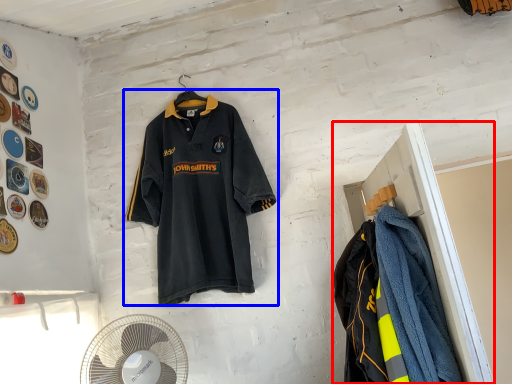
Question: Among these objects, which one is farthest to the camera, closet (highlighted by a red box) or sports uniform (highlighted by a blue box)?

Choices:
 (A) closet
 (B) sports uniform

Answer: (B)